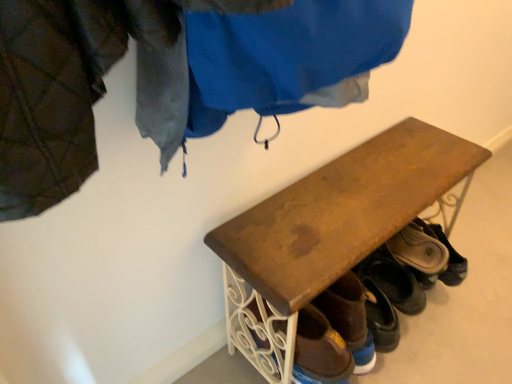
At what (x,y) coordinates should I click in order to perform the action: click on free space to the right of wooden bench at center. Please return your answer as a coordinate pair (x, y). This screenshot has height=384, width=512. Looking at the image, I should click on tap(471, 295).